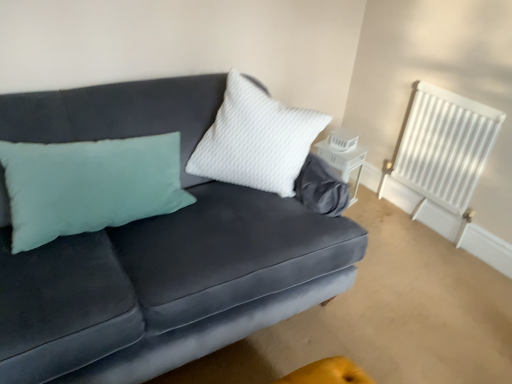
Find the location of a particular element. This screenshot has height=384, width=512. velvet dark blue couch at center is located at coordinates (156, 251).

What is the approximate height of white painted metal radiator at upper right?

white painted metal radiator at upper right is 75.46 centimeters in height.

The image size is (512, 384). Find the location of `velvet dark blue couch at center`. velvet dark blue couch at center is located at coordinates (156, 251).

Is the depth of white matte lantern at center less than that of white painted metal radiator at upper right?

No, white matte lantern at center is further to the viewer.

Who is shorter, white matte lantern at center or white painted metal radiator at upper right?

With less height is white matte lantern at center.

Is point (346, 144) positioned behind point (459, 200)?

Yes, point (346, 144) is farther from viewer.

From a real-world perspective, who is located lower, white matte lantern at center or white painted metal radiator at upper right?

white matte lantern at center.

Between white matte lantern at center and velvet dark blue couch at center, which one has smaller size?

white matte lantern at center.

In the scene shown: From the image's perspective, is white matte lantern at center above velvet dark blue couch at center?

Correct, white matte lantern at center appears higher than velvet dark blue couch at center in the image.

Would you say white matte lantern at center is outside velvet dark blue couch at center?

Yes, white matte lantern at center is outside of velvet dark blue couch at center.

In the scene shown: Can you confirm if velvet dark blue couch at center is shorter than white matte lantern at center?

Incorrect, the height of velvet dark blue couch at center does not fall short of that of white matte lantern at center.

From a real-world perspective, who is located higher, velvet dark blue couch at center or white matte lantern at center?

velvet dark blue couch at center, from a real-world perspective.

Considering the points (14, 114) and (341, 152), which point is behind, point (14, 114) or point (341, 152)?

Point (341, 152)

From the image's perspective, is white painted metal radiator at upper right positioned above or below white matte lantern at center?

white painted metal radiator at upper right is situated higher than white matte lantern at center in the image.

Is white painted metal radiator at upper right not near white matte lantern at center?

white painted metal radiator at upper right is actually quite close to white matte lantern at center.

Could you tell me if white painted metal radiator at upper right is turned towards white matte lantern at center?

Yes, white painted metal radiator at upper right is facing white matte lantern at center.

From a real-world perspective, which object rests below the other?

In real-world perspective, white painted metal radiator at upper right is lower.

In the scene shown: Who is smaller, white painted metal radiator at upper right or velvet dark blue couch at center?

white painted metal radiator at upper right.

Is velvet dark blue couch at center inside white painted metal radiator at upper right?

No, velvet dark blue couch at center is not a part of white painted metal radiator at upper right.

Considering the positions of point (380, 192) and point (290, 302), is point (380, 192) closer or farther from the camera than point (290, 302)?

Clearly, point (380, 192) is more distant from the camera than point (290, 302).

Looking at this image, which of these two, velvet dark blue couch at center or white painted metal radiator at upper right, is smaller?

white painted metal radiator at upper right.

Considering their positions, is velvet dark blue couch at center located in front of or behind white painted metal radiator at upper right?

Clearly, velvet dark blue couch at center is in front of white painted metal radiator at upper right.

Is velvet dark blue couch at center looking in the opposite direction of white painted metal radiator at upper right?

velvet dark blue couch at center is not turned away from white painted metal radiator at upper right.

Identify the location of radiator in front of the white matte lantern at center. The image size is (512, 384). (444, 146).

Locate an element on the screen. Image resolution: width=512 pixels, height=384 pixels. studio couch positioned vertically above the white matte lantern at center (from a real-world perspective) is located at coordinates (156, 251).

Looking at the image, which one is located closer to white matte lantern at center, velvet dark blue couch at center or white painted metal radiator at upper right?

The object closer to white matte lantern at center is white painted metal radiator at upper right.

When comparing their distances from velvet dark blue couch at center, does white matte lantern at center or white painted metal radiator at upper right seem closer?

The object closer to velvet dark blue couch at center is white matte lantern at center.

Which object lies nearer to the anchor point velvet dark blue couch at center, white painted metal radiator at upper right or white matte lantern at center?

white matte lantern at center is positioned closer to the anchor velvet dark blue couch at center.

When comparing their distances from white painted metal radiator at upper right, does white matte lantern at center or velvet dark blue couch at center seem closer?

white matte lantern at center lies closer to white painted metal radiator at upper right than the other object.

Looking at this image, from the image, which object appears to be farther from white matte lantern at center, white painted metal radiator at upper right or velvet dark blue couch at center?

velvet dark blue couch at center is further to white matte lantern at center.

In the scene shown: Which object lies further to the anchor point white painted metal radiator at upper right, velvet dark blue couch at center or white matte lantern at center?

Based on the image, velvet dark blue couch at center appears to be further to white painted metal radiator at upper right.

Where is `radiator between velvet dark blue couch at center and white matte lantern at center along the z-axis`? This screenshot has width=512, height=384. radiator between velvet dark blue couch at center and white matte lantern at center along the z-axis is located at coordinates (444, 146).